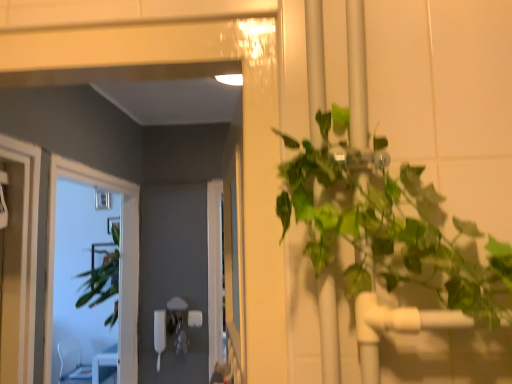
Question: Considering the positions of clear glass window at left and clear plastic chair at lower left in the image, is clear glass window at left taller or shorter than clear plastic chair at lower left?

Choices:
 (A) short
 (B) tall

Answer: (B)

Question: From the image's perspective, is clear glass window at left above or below clear plastic chair at lower left?

Choices:
 (A) above
 (B) below

Answer: (A)

Question: From a real-world perspective, is clear glass window at left positioned above or below clear plastic chair at lower left?

Choices:
 (A) above
 (B) below

Answer: (A)

Question: From a real-world perspective, is clear plastic chair at lower left above or below clear glass window at left?

Choices:
 (A) below
 (B) above

Answer: (A)

Question: Based on their sizes in the image, would you say clear plastic chair at lower left is bigger or smaller than clear glass window at left?

Choices:
 (A) big
 (B) small

Answer: (B)

Question: Do you think clear plastic chair at lower left is within clear glass window at left, or outside of it?

Choices:
 (A) inside
 (B) outside

Answer: (B)

Question: Is point (66, 339) positioned closer to the camera than point (113, 188)?

Choices:
 (A) farther
 (B) closer

Answer: (A)